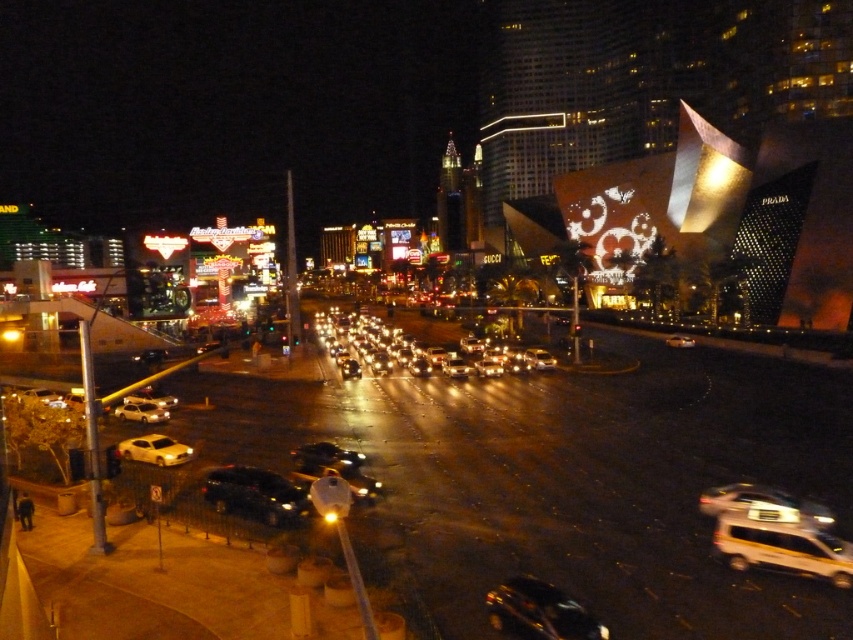
Question: Which point appears closest to the camera in this image?

Choices:
 (A) (357, 452)
 (B) (830, 563)
 (C) (679, 336)
 (D) (142, 388)

Answer: (B)

Question: Does metallic silver sedan at center appear under white glossy sedan at lower left?

Choices:
 (A) yes
 (B) no

Answer: (A)

Question: Can you confirm if shiny black suv at center is thinner than shiny black car at center?

Choices:
 (A) no
 (B) yes

Answer: (A)

Question: Is yellow metallic van at lower right positioned in front of yellow matte taxi at lower left?

Choices:
 (A) no
 (B) yes

Answer: (B)

Question: Which point is closer to the camera taking this photo?

Choices:
 (A) (666, 339)
 (B) (728, 488)

Answer: (B)

Question: Which object appears closest to the camera in this image?

Choices:
 (A) shiny black car at center
 (B) shiny black sedan at center
 (C) shiny gold car at center
 (D) yellow metallic van at lower right

Answer: (D)